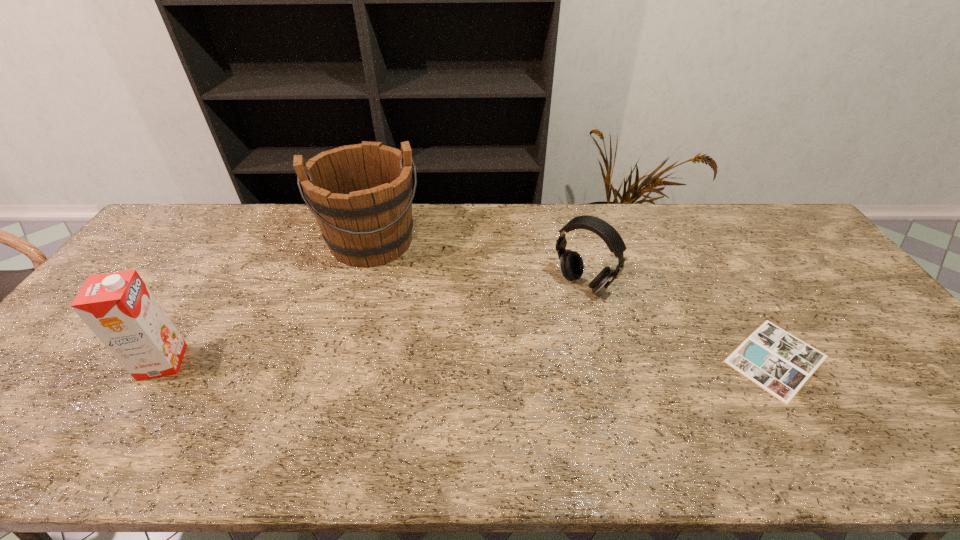
The width and height of the screenshot is (960, 540). In order to click on carton in this screenshot , I will do `click(118, 307)`.

At what (x,y) coordinates should I click in order to perform the action: click on book. Please return your answer as a coordinate pair (x, y). Looking at the image, I should click on (780, 363).

Locate an element on the screen. the shortest object is located at coordinates (780, 363).

Image resolution: width=960 pixels, height=540 pixels. I want to click on the third tallest object, so click(571, 263).

Find the location of a particular element. This screenshot has height=540, width=960. earphone is located at coordinates (571, 263).

Where is `the second object from left to right`? This screenshot has height=540, width=960. the second object from left to right is located at coordinates (361, 195).

Identify the location of vacant space situated 0.080m on the front of the leftmost object. Image resolution: width=960 pixels, height=540 pixels. (132, 411).

Find the location of `free location located 0.160m on the left of the rightmost object`. free location located 0.160m on the left of the rightmost object is located at coordinates (658, 359).

Image resolution: width=960 pixels, height=540 pixels. I want to click on free region located 0.380m on the ear cups of the second object from right to left, so click(x=484, y=387).

Where is `vacant region located 0.070m on the ear cups of the second object from right to left`? The image size is (960, 540). vacant region located 0.070m on the ear cups of the second object from right to left is located at coordinates (554, 312).